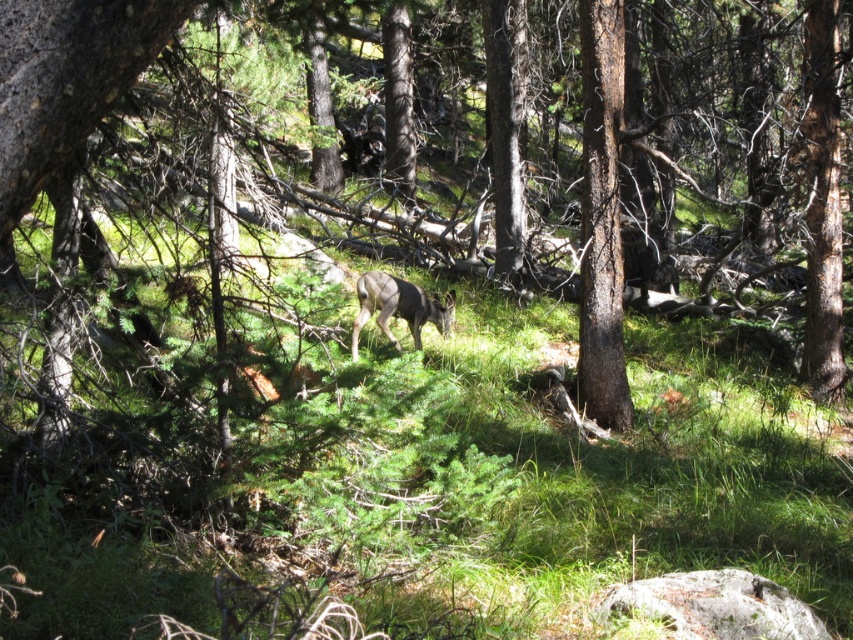
Does brown rough bark tree at right appear over brown fur deer at center?

Yes.

Consider the image. Can you confirm if brown rough bark tree at right is taller than brown fur deer at center?

Indeed, brown rough bark tree at right has a greater height compared to brown fur deer at center.

You are a GUI agent. You are given a task and a screenshot of the screen. Output one action in this format:
    pyautogui.click(x=<x>, y=<y>)
    Task: Click on the brown rough bark tree at right
    This screenshot has height=640, width=853.
    Given the screenshot: What is the action you would take?
    pyautogui.click(x=601, y=218)